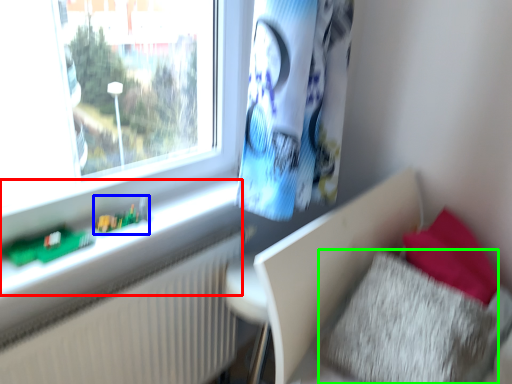
Question: Considering the real-world distances, which object is farthest from window sill (highlighted by a red box)? toy (highlighted by a blue box) or pillow (highlighted by a green box)?

Choices:
 (A) toy
 (B) pillow

Answer: (B)